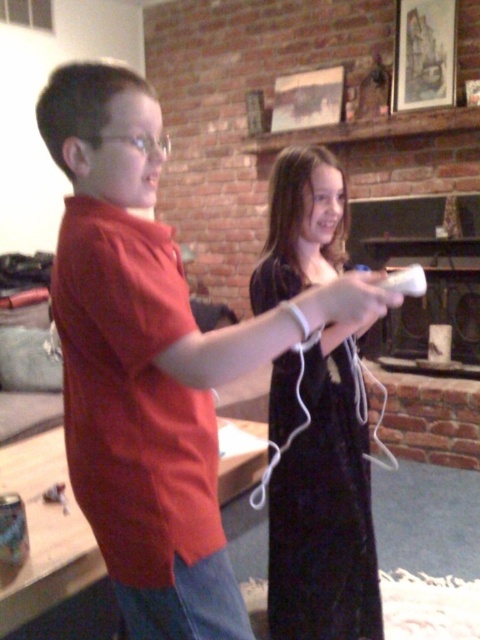
Who is positioned more to the right, matte red shirt at center or white matte remote at center?

Positioned to the right is white matte remote at center.

Based on the photo, does matte red shirt at center come in front of white matte remote at center?

Yes, matte red shirt at center is closer to the viewer.

Does point (180, 346) come closer to viewer compared to point (396, 289)?

Yes, it is in front of point (396, 289).

Locate an element on the screen. matte red shirt at center is located at coordinates (152, 360).

Between matte red shirt at center and black velvet dress at center, which one has more height?

black velvet dress at center

Who is shorter, matte red shirt at center or black velvet dress at center?

matte red shirt at center

What do you see at coordinates (152, 360) in the screenshot?
I see `matte red shirt at center` at bounding box center [152, 360].

Locate an element on the screen. matte red shirt at center is located at coordinates (152, 360).

Can you confirm if black velvet dress at center is positioned to the left of white matte remote at center?

Indeed, black velvet dress at center is positioned on the left side of white matte remote at center.

Which is more to the right, black velvet dress at center or white matte remote at center?

From the viewer's perspective, white matte remote at center appears more on the right side.

Between point (364, 616) and point (393, 289), which one is positioned behind?

Positioned behind is point (364, 616).

Find the location of a particular element. The width and height of the screenshot is (480, 640). black velvet dress at center is located at coordinates (324, 509).